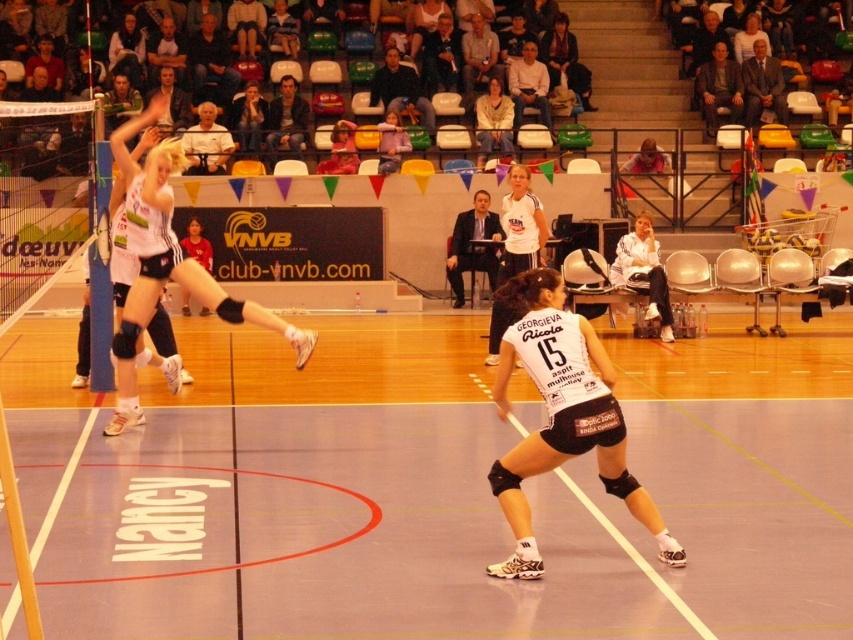
Question: Considering the real-world distances, which object is closest to the blonde hair at center?

Choices:
 (A) smooth wooden floor at center
 (B) dark brown leather jacket at upper center
 (C) white fabric jacket at upper right
 (D) white matte knee pads at upper left

Answer: (B)

Question: Does white matte knee pads at upper left appear over dark brown leather jacket at upper center?

Choices:
 (A) no
 (B) yes

Answer: (A)

Question: Which point appears closest to the camera in this image?

Choices:
 (A) (546, 60)
 (B) (483, 141)

Answer: (B)

Question: Can you confirm if dark brown leather jacket at upper center is positioned to the right of light beige sweater at upper center?

Choices:
 (A) yes
 (B) no

Answer: (A)

Question: Observing the image, what is the correct spatial positioning of white matte uniform at center in reference to blonde hair at center?

Choices:
 (A) below
 (B) above

Answer: (A)

Question: Among these objects, which one is farthest from the camera?

Choices:
 (A) blonde hair at center
 (B) white matte shirt at center
 (C) smooth wooden floor at center

Answer: (A)